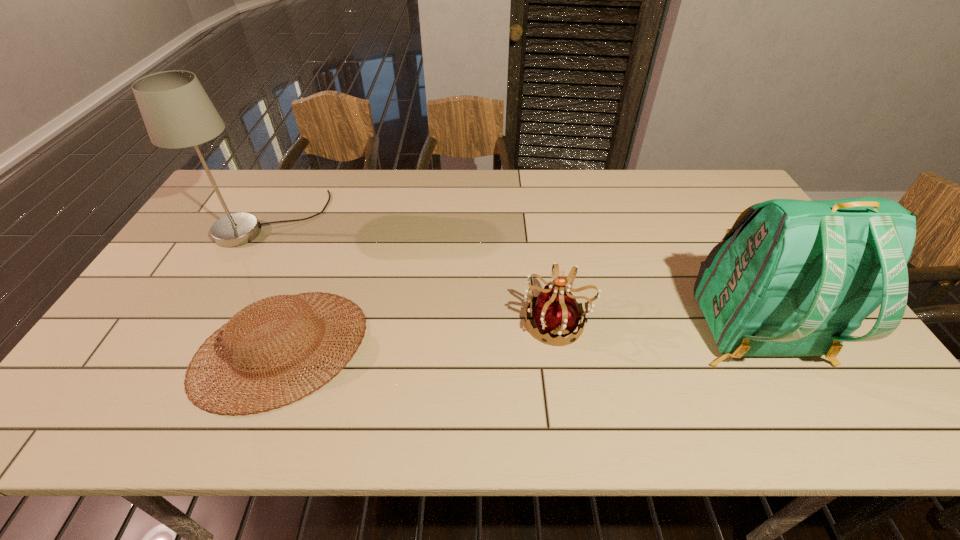
Locate which object is the second closest to the rightmost object. Please provide its 2D coordinates. Your answer should be formatted as a tuple, i.e. [(x, y)], where the tuple contains the x and y coordinates of a point satisfying the conditions above.

[(240, 325)]

Locate which object ranks third in proximity to the farthest object. Please provide its 2D coordinates. Your answer should be formatted as a tuple, i.e. [(x, y)], where the tuple contains the x and y coordinates of a point satisfying the conditions above.

[(791, 277)]

Identify the location of free space that satisfies the following two spatial constraints: 1. on the front side of the sunhat; 2. on the left side of the table lamp. (201, 348).